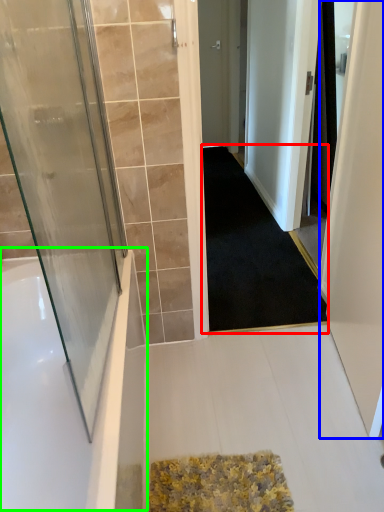
Question: Estimate the real-world distances between objects in this image. Which object is farther from doormat (highlighted by a red box), screen door (highlighted by a blue box) or bath (highlighted by a green box)?

Choices:
 (A) screen door
 (B) bath

Answer: (B)